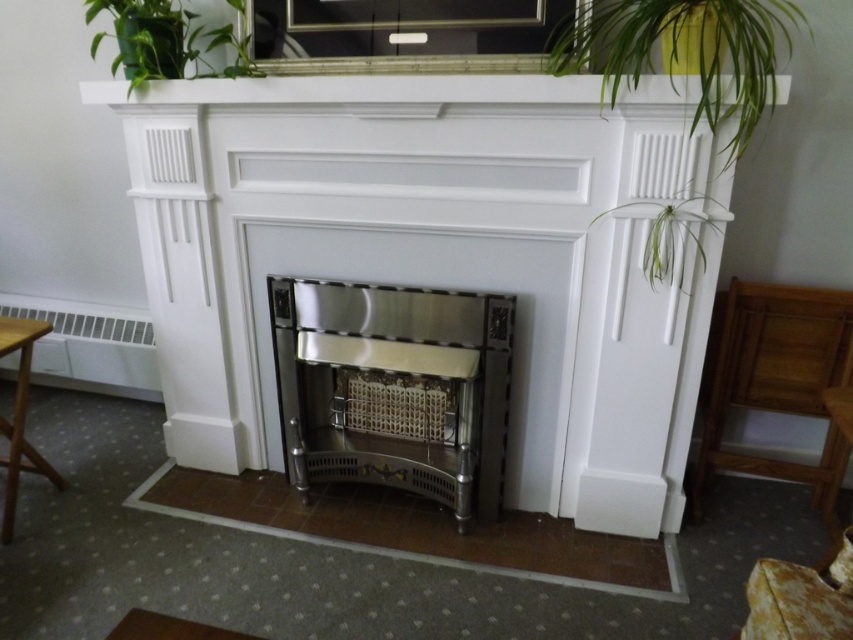
Does leather textured armchair at lower right lie behind light brown wooden table at left?

No.

Describe the element at coordinates (799, 598) in the screenshot. The width and height of the screenshot is (853, 640). I see `leather textured armchair at lower right` at that location.

Image resolution: width=853 pixels, height=640 pixels. Find the location of `leather textured armchair at lower right`. leather textured armchair at lower right is located at coordinates (799, 598).

Between green leafy plant at upper right and green leafy plant at upper left, which one has more height?

green leafy plant at upper right

Image resolution: width=853 pixels, height=640 pixels. In order to click on green leafy plant at upper right in this screenshot , I will do `click(682, 51)`.

Between point (329, 369) and point (693, 52), which one is positioned behind?

The point (329, 369) is behind.

Consider the image. Who is taller, stainless steel fireplace at center or green leafy plant at upper right?

stainless steel fireplace at center is taller.

Is point (486, 330) less distant than point (723, 10)?

No, it is behind (723, 10).

Identify the location of stainless steel fireplace at center. The height and width of the screenshot is (640, 853). (393, 388).